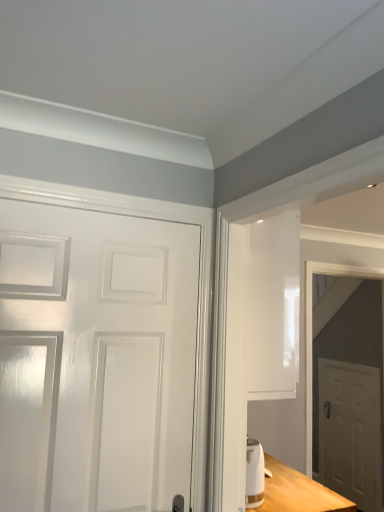
Question: Is white matte door at right, the second door positioned from the left, beside white glossy door at right?

Choices:
 (A) yes
 (B) no

Answer: (B)

Question: Is white matte door at right, the 2th door positioned from the front, facing towards white glossy door at right?

Choices:
 (A) no
 (B) yes

Answer: (A)

Question: Is white matte door at right, the 2th door positioned from the front, far away from white glossy door at right?

Choices:
 (A) yes
 (B) no

Answer: (B)

Question: Is white matte door at right, which is the 1th door in back-to-front order, taller than white glossy door at right?

Choices:
 (A) no
 (B) yes

Answer: (A)

Question: Can you confirm if white matte door at right, which is the first door from right to left, is positioned to the right of white glossy door at right?

Choices:
 (A) yes
 (B) no

Answer: (A)

Question: Is white glossy door at right completely or partially inside white matte door at right, which is the first door from right to left?

Choices:
 (A) no
 (B) yes

Answer: (A)

Question: From a real-world perspective, is white glossy door at right over white matte door at right, which is the first door from right to left?

Choices:
 (A) yes
 (B) no

Answer: (A)

Question: Is white glossy door at right bigger than white matte door at right, the 2th door positioned from the front?

Choices:
 (A) yes
 (B) no

Answer: (A)

Question: Does white glossy door at right contain white matte door at right, which is the 1th door in back-to-front order?

Choices:
 (A) yes
 (B) no

Answer: (B)

Question: Considering the relative positions of white glossy door at right and white matte door at right, the second door positioned from the left, in the image provided, is white glossy door at right to the left of white matte door at right, the second door positioned from the left, from the viewer's perspective?

Choices:
 (A) yes
 (B) no

Answer: (A)

Question: Does white glossy door at right lie behind white matte door at right, which is counted as the second door, starting from the top?

Choices:
 (A) yes
 (B) no

Answer: (B)

Question: Is white glossy door at right completely or partially outside of white matte door at right, the 2th door positioned from the front?

Choices:
 (A) yes
 (B) no

Answer: (A)

Question: Is white glossy door at left, positioned as the 2th door in right-to-left order, taller than white matte door at right, which is the first door from right to left?

Choices:
 (A) no
 (B) yes

Answer: (A)